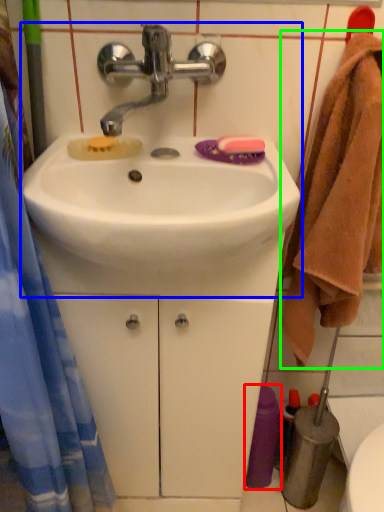
Question: Which is farther away from toiletry (highlighted by a red box)? sink (highlighted by a blue box) or bath towel (highlighted by a green box)?

Choices:
 (A) sink
 (B) bath towel

Answer: (A)